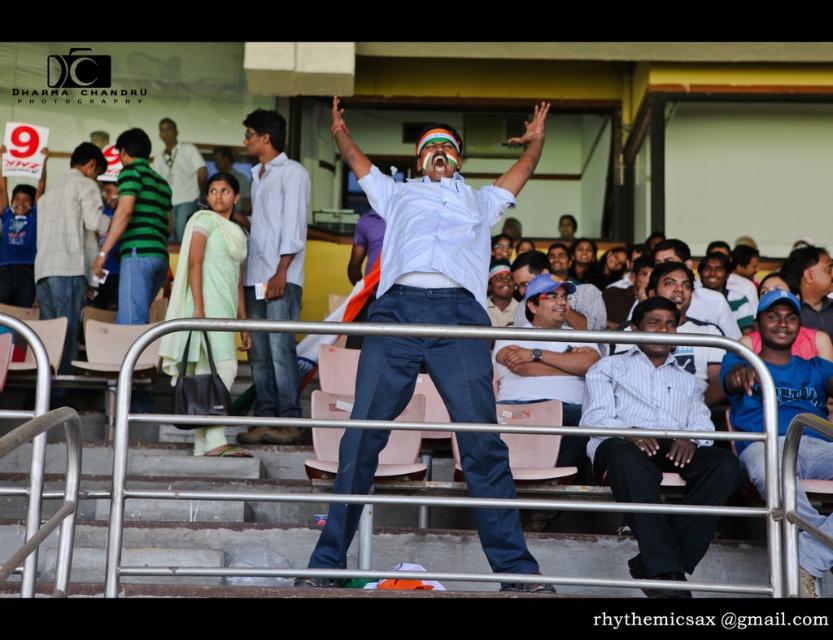
You are a photographer at the stadium and want to capture both the light green fabric saree at center and the matte green shirt at left in a single photo. Which object should you focus on first to ensure both are in frame?

The light green fabric saree at center is positioned on the right side of matte green shirt at left, so you should focus on the matte green shirt at left first to ensure both are in frame.

Based on the photo, you are a photographer trying to capture a clear shot of the central figure. There are two obstacles in your viewfinder, the light green fabric saree at center and the matte green shirt at center. Which obstacle is shorter and can be stepped over easily?

The light green fabric saree at center is not as tall as matte green shirt at center, so it is shorter and can be stepped over easily.